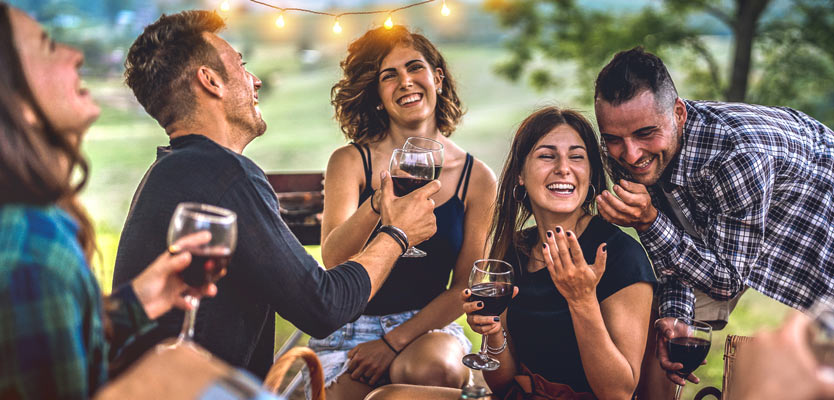
Find the location of a particular element. This screenshot has height=400, width=834. wine glass is located at coordinates (215, 232), (420, 168), (500, 285), (696, 348), (831, 327).